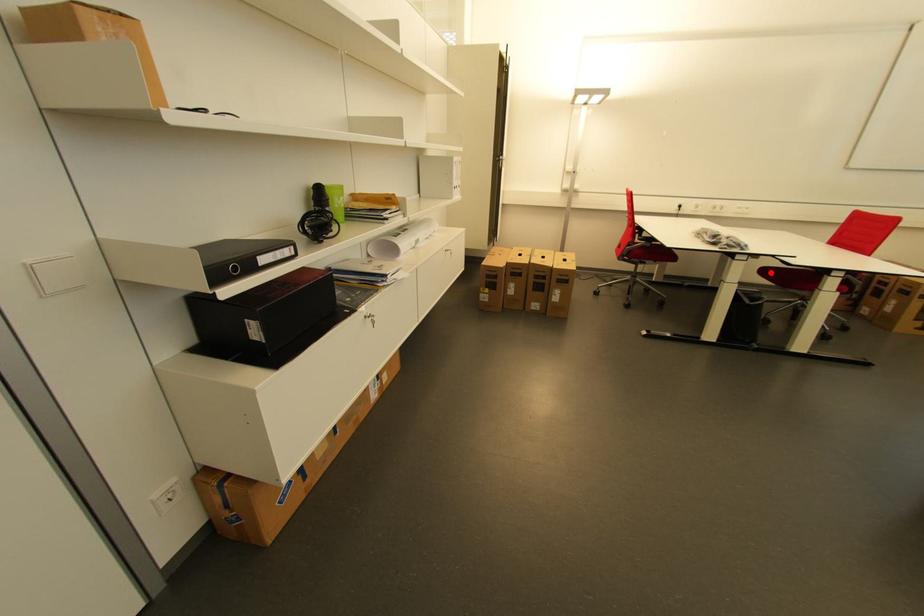
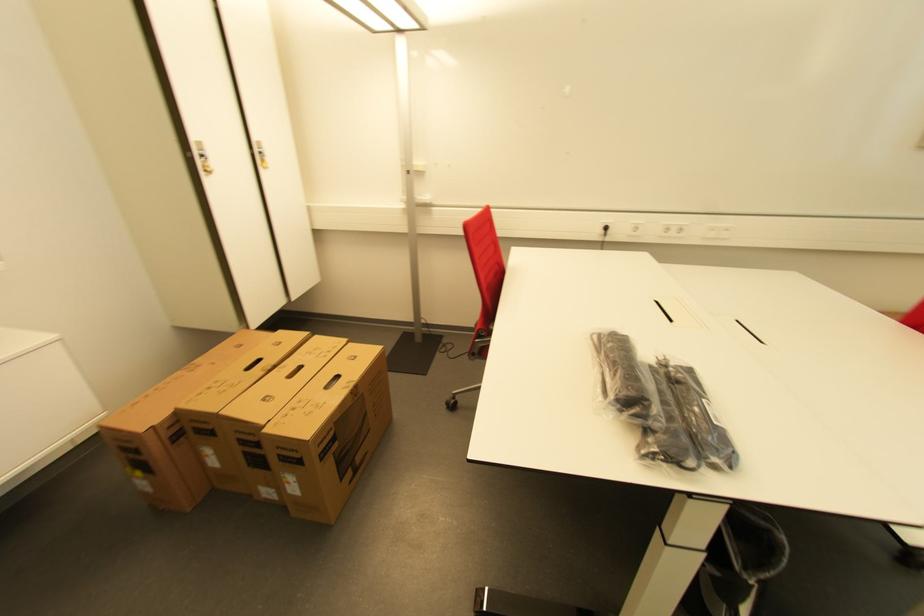
Question: I am providing you with two images of the same scene from different viewpoints. A red point is marked on the first image. Can you still see the location of the red point in image 2?

Choices:
 (A) Yes
 (B) No

Answer: (B)